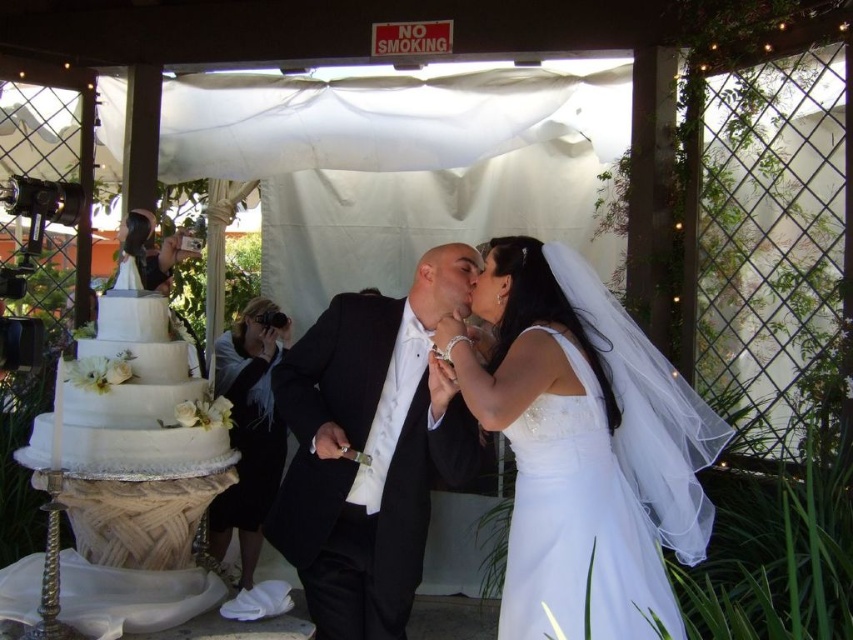
You are a photographer at the wedding. You need to position yourself so that both the point at (379, 536) and the point at (161, 394) are visible in your shot. Given that you can only move forward or backward along the line connecting these two points, which direction should you move to ensure both points are in frame?

To ensure both points are visible, you should move backward along the line connecting them. Since point (379, 536) is behind point (161, 394), moving backward will allow the camera to capture both the foreground and background points in the frame.

You are a photographer at the wedding. You need to capture a closeup shot of the couple without any part of the white satin dress at center or black satin tuxedo at center being cut off. What is the minimum distance you should keep between the camera and the couple?

The minimum distance should be at least 41.98 centimeters to ensure both the white satin dress at center and black satin tuxedo at center are fully in frame without any cutoff.